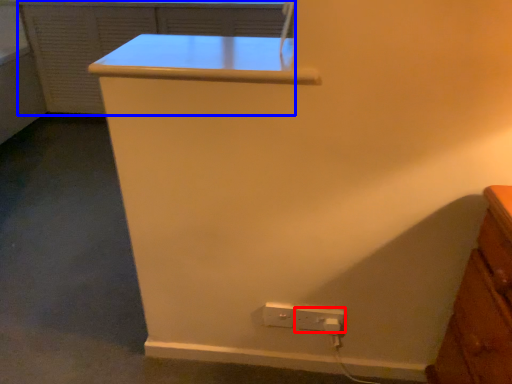
Question: Which object appears closest to the camera in this image, power plugs and sockets (highlighted by a red box) or file cabinet (highlighted by a blue box)?

Choices:
 (A) power plugs and sockets
 (B) file cabinet

Answer: (A)